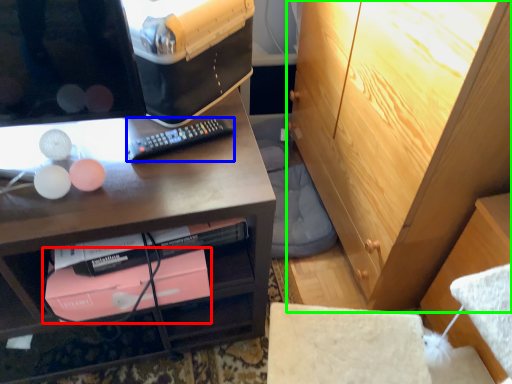
Question: Estimate the real-world distances between objects in this image. Which object is farther from book (highlighted by a red box), remote control (highlighted by a blue box) or cabinetry (highlighted by a green box)?

Choices:
 (A) remote control
 (B) cabinetry

Answer: (B)